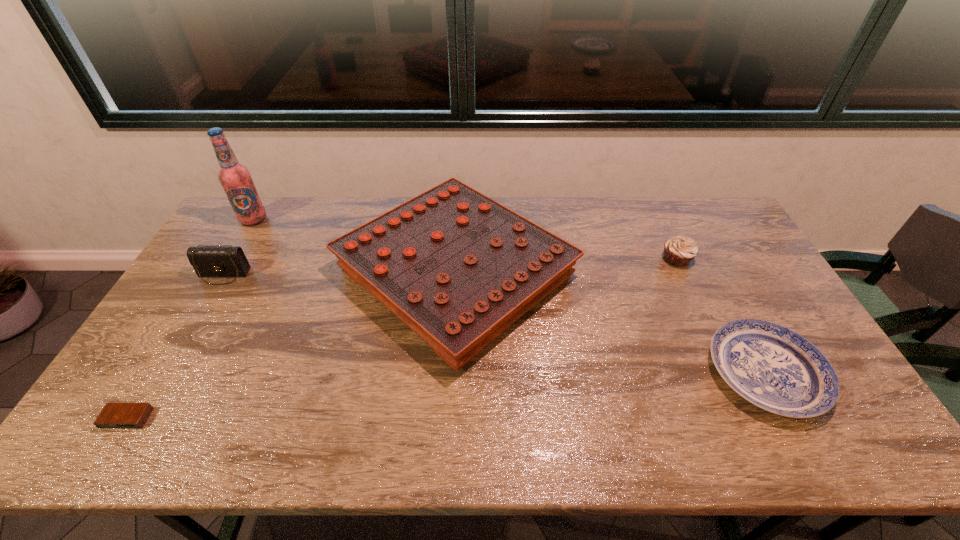
This screenshot has width=960, height=540. In order to click on the tallest object in this screenshot , I will do `click(235, 178)`.

Where is `gameboard`? gameboard is located at coordinates (x=458, y=268).

You are a GUI agent. You are given a task and a screenshot of the screen. Output one action in this format:
    pyautogui.click(x=<x>, y=<y>)
    Task: Click on the clutch bag
    
    Given the screenshot: What is the action you would take?
    pyautogui.click(x=211, y=261)

Find the location of a particular element. This screenshot has width=960, height=540. the fourth tallest object is located at coordinates (678, 251).

What are the coordinates of `the fifth tallest object` in the screenshot? It's located at (771, 366).

This screenshot has height=540, width=960. I want to click on alarm clock, so click(114, 415).

Locate an element on the screen. This screenshot has width=960, height=540. vacant space located on the right of the alcohol is located at coordinates (344, 219).

The width and height of the screenshot is (960, 540). In order to click on vacant space situated 0.220m on the right of the gameboard in this screenshot , I will do `click(647, 273)`.

I want to click on free space located on the front flap of the clutch bag, so click(177, 354).

Image resolution: width=960 pixels, height=540 pixels. I want to click on vacant space located 0.400m on the left of the third shortest object, so click(x=540, y=259).